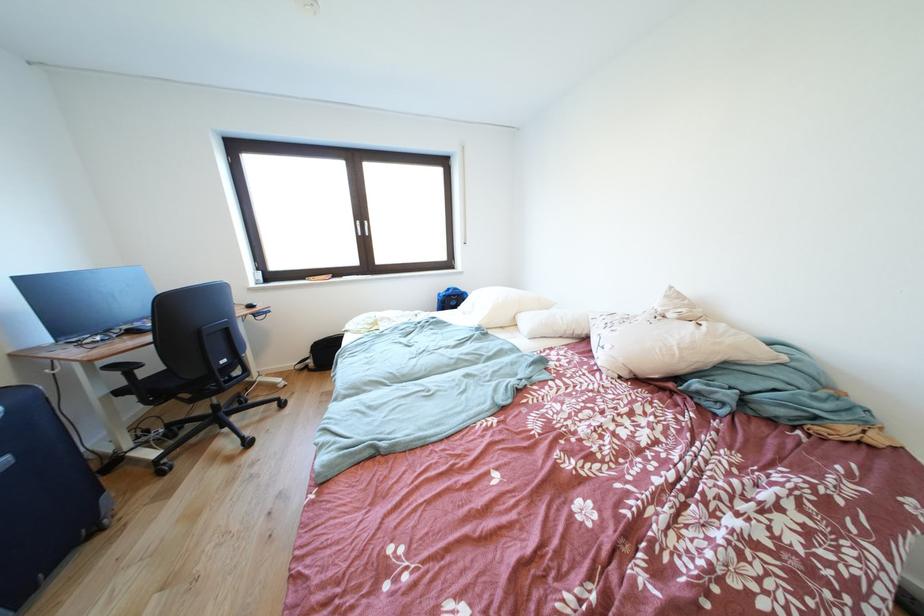
Find where to resting arm the chair armrest. Please return your answer as a coordinate pair (x, y).

(124, 369)